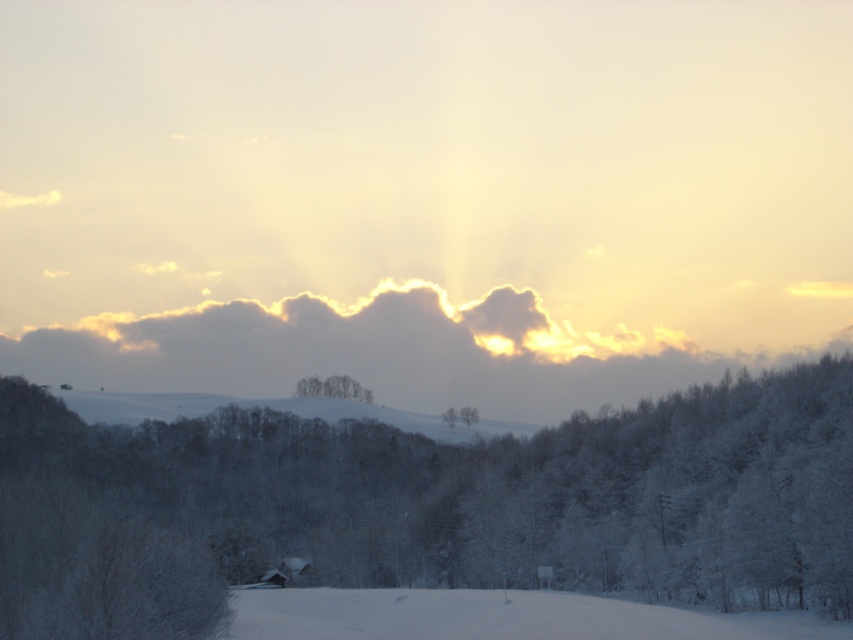
You are a hiker who wants to take a photo of the white frosty tree at center and the white powdery snow at lower center in the winter landscape. How far apart are these two features?

The white frosty tree at center and the white powdery snow at lower center are 16.79 meters apart from each other.